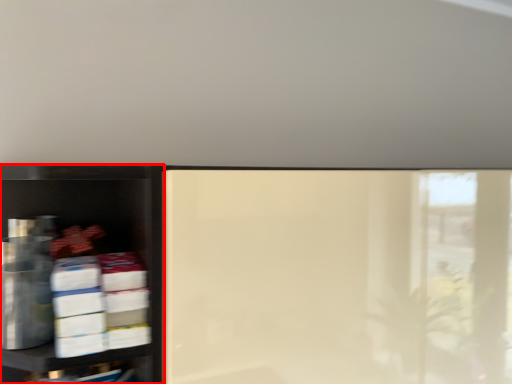
Question: Where is shelf (annotated by the red box) located in relation to shelf in the image?

Choices:
 (A) right
 (B) left

Answer: (B)